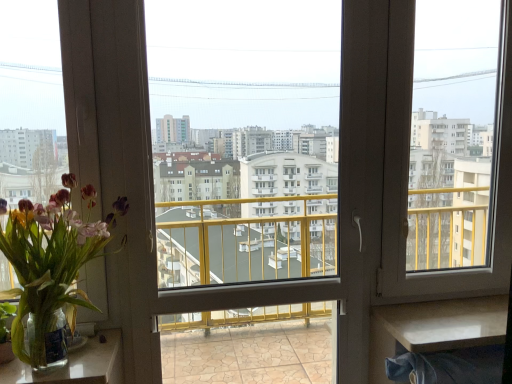
Question: Is white glossy table at lower right, the second table viewed from the left, at the left side of clear glass vase at lower left, which is the second table from right to left?

Choices:
 (A) no
 (B) yes

Answer: (A)

Question: From the image's perspective, is white glossy table at lower right, marked as the 1th table in a right-to-left arrangement, beneath clear glass vase at lower left, which is the second table from right to left?

Choices:
 (A) no
 (B) yes

Answer: (A)

Question: Is white glossy table at lower right, marked as the 1th table in a right-to-left arrangement, further to the viewer compared to clear glass vase at lower left, which is the second table from right to left?

Choices:
 (A) yes
 (B) no

Answer: (A)

Question: Could clear glass vase at lower left, arranged as the first table when viewed from the left, be considered to be inside white glossy table at lower right, the second table viewed from the left?

Choices:
 (A) yes
 (B) no

Answer: (B)

Question: From a real-world perspective, is white glossy table at lower right, the second table viewed from the left, on top of clear glass vase at lower left, which is the second table from right to left?

Choices:
 (A) no
 (B) yes

Answer: (A)

Question: Is clear glass vase at lower left, which is the second table from right to left, surrounding transparent glass window screen at right, marked as the 1th window screen in a right-to-left arrangement?

Choices:
 (A) yes
 (B) no

Answer: (B)

Question: Can you confirm if clear glass vase at lower left, arranged as the first table when viewed from the left, is positioned to the left of transparent glass window screen at right, the second window screen viewed from the left?

Choices:
 (A) yes
 (B) no

Answer: (A)

Question: Does clear glass vase at lower left, which is the second table from right to left, have a larger size compared to transparent glass window screen at right, marked as the 1th window screen in a right-to-left arrangement?

Choices:
 (A) no
 (B) yes

Answer: (A)

Question: Is clear glass vase at lower left, arranged as the first table when viewed from the left, positioned far away from transparent glass window screen at right, the second window screen viewed from the left?

Choices:
 (A) yes
 (B) no

Answer: (A)

Question: Is clear glass vase at lower left, which is the second table from right to left, oriented away from transparent glass window screen at right, marked as the 1th window screen in a right-to-left arrangement?

Choices:
 (A) yes
 (B) no

Answer: (B)

Question: Considering the relative sizes of clear glass vase at lower left, arranged as the first table when viewed from the left, and transparent glass window screen at right, the second window screen viewed from the left, in the image provided, is clear glass vase at lower left, arranged as the first table when viewed from the left, thinner than transparent glass window screen at right, the second window screen viewed from the left,?

Choices:
 (A) no
 (B) yes

Answer: (A)

Question: Is the depth of translucent glass vase at left greater than that of clear glass vase at lower left, arranged as the first table when viewed from the left?

Choices:
 (A) no
 (B) yes

Answer: (A)